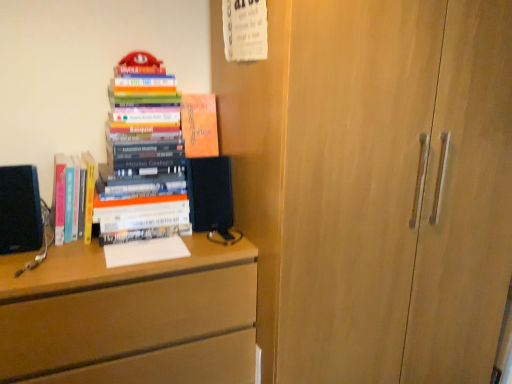
Question: Is point (194, 97) positioned closer to the camera than point (229, 294)?

Choices:
 (A) farther
 (B) closer

Answer: (A)

Question: Is matte orange book at upper center, the first book from the right, situated inside matte wood chest of drawers at left or outside?

Choices:
 (A) inside
 (B) outside

Answer: (B)

Question: Considering the real-world distances, which object is closest to the hardcover books at left, placed as the 1th book when sorted from left to right?

Choices:
 (A) matte orange book at upper center, marked as the 3th book in a left-to-right arrangement
 (B) hardcover books at left, the second book positioned from the left
 (C) matte wood chest of drawers at left
 (D) black matte speaker at center

Answer: (B)

Question: Which object is the closest to the hardcover books at left, the 2th book viewed from the right?

Choices:
 (A) matte orange book at upper center, the first book from the right
 (B) black matte speaker at center
 (C) matte wood chest of drawers at left
 (D) hardcover books at left, the third book from the right

Answer: (B)